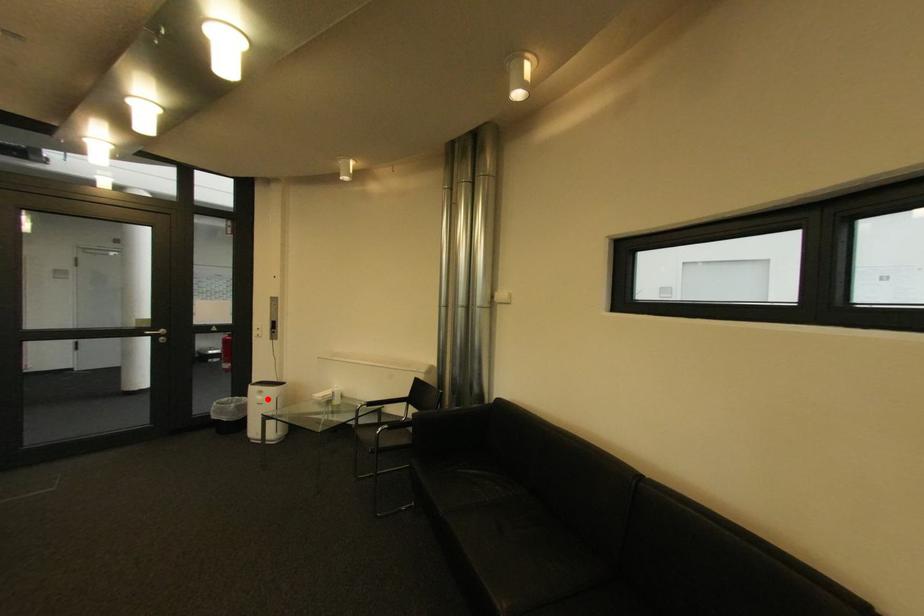
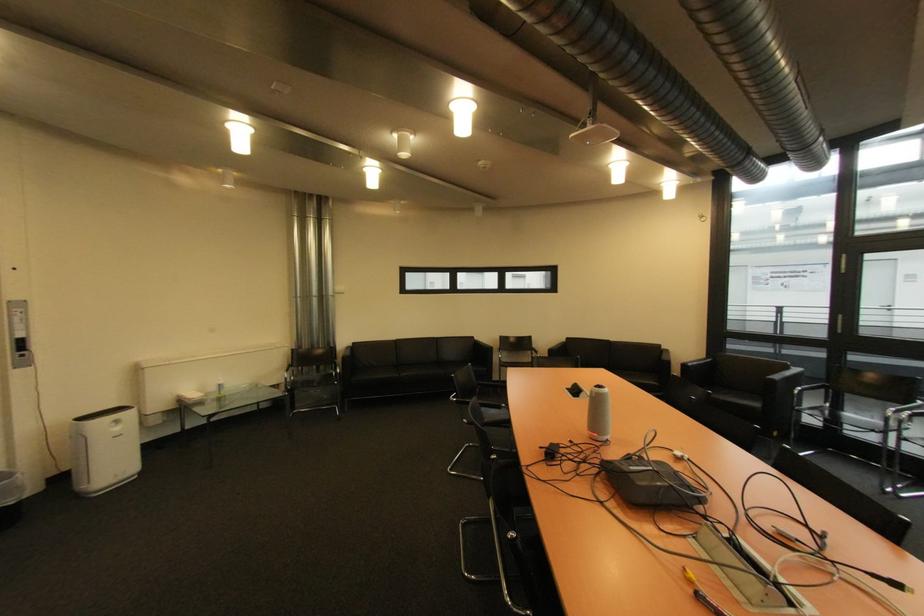
Where in the second image is the point corresponding to the highlighted location from the first image?

(124, 430)